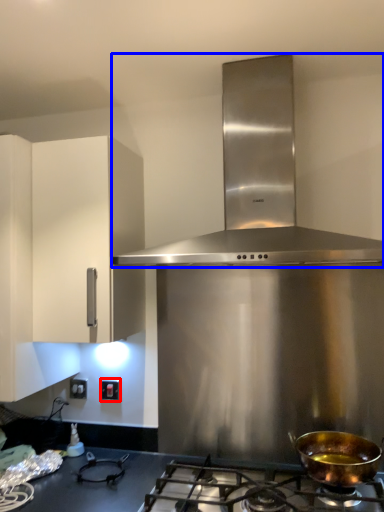
Question: Among these objects, which one is farthest to the camera, electric outlet (highlighted by a red box) or home appliance (highlighted by a blue box)?

Choices:
 (A) electric outlet
 (B) home appliance

Answer: (A)